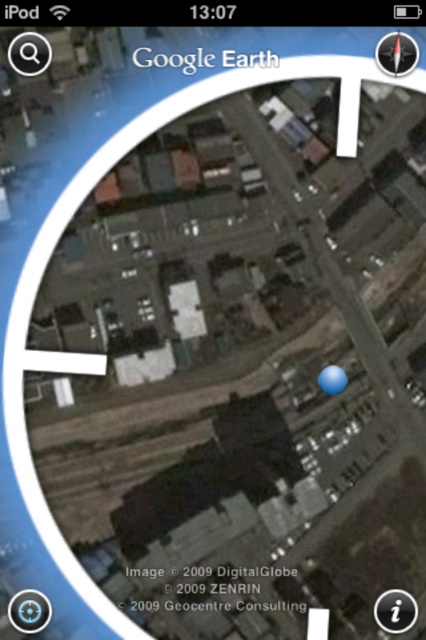
Question: Does transparent blue circle at center have a lesser width compared to matte compass at upper right?

Choices:
 (A) yes
 (B) no

Answer: (B)

Question: Observing the image, what is the correct spatial positioning of transparent blue button at center in reference to matte compass at upper right?

Choices:
 (A) above
 (B) below

Answer: (B)

Question: Does white paper at center come behind transparent blue circle at center?

Choices:
 (A) no
 (B) yes

Answer: (A)

Question: Which point is farther from the camera taking this photo?

Choices:
 (A) (29, 614)
 (B) (143, 58)
 (C) (408, 44)
 (D) (46, 65)

Answer: (B)

Question: Estimate the real-world distances between objects in this image. Which object is farther from the white paper at center?

Choices:
 (A) transparent blue circle at center
 (B) transparent blue button at center
 (C) transparent glass circle at upper left
 (D) matte compass at upper right

Answer: (A)

Question: Which of the following is the farthest from the observer?

Choices:
 (A) white paper at center
 (B) matte compass at upper right
 (C) transparent blue button at center

Answer: (A)